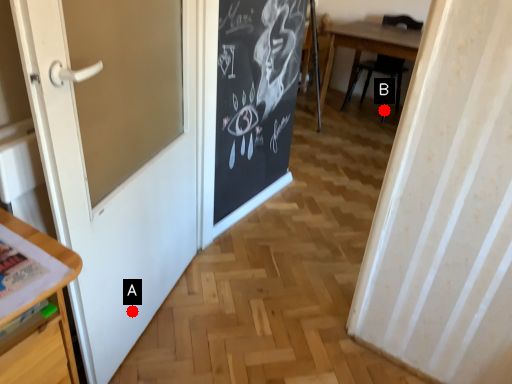
Question: Two points are circled on the image, labeled by A and B beside each circle. Which of the following is the farthest from the observer?

Choices:
 (A) A is further
 (B) B is further

Answer: (B)